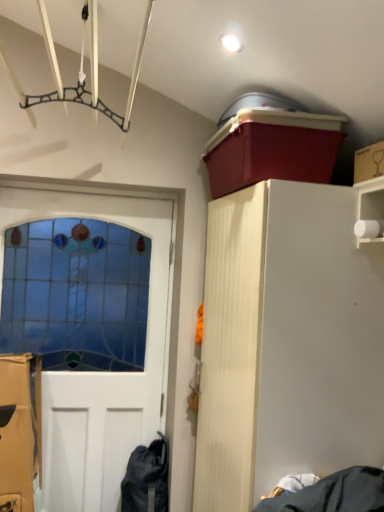
Question: Should I look upward or downward to see cardboard box at upper right?

Choices:
 (A) down
 (B) up

Answer: (B)

Question: Does stained glass door at left turn towards matte plastic storage bin at upper right?

Choices:
 (A) no
 (B) yes

Answer: (A)

Question: Does stained glass door at left have a greater width compared to matte plastic storage bin at upper right?

Choices:
 (A) no
 (B) yes

Answer: (A)

Question: Is stained glass door at left looking in the opposite direction of matte plastic storage bin at upper right?

Choices:
 (A) no
 (B) yes

Answer: (A)

Question: From a real-world perspective, is stained glass door at left positioned over matte plastic storage bin at upper right based on gravity?

Choices:
 (A) no
 (B) yes

Answer: (A)

Question: Is stained glass door at left positioned beyond the bounds of matte plastic storage bin at upper right?

Choices:
 (A) yes
 (B) no

Answer: (A)

Question: Are stained glass door at left and matte plastic storage bin at upper right far apart?

Choices:
 (A) yes
 (B) no

Answer: (B)

Question: Considering the relative positions of cardboard box at upper right and white wood cabinet at upper right in the image provided, is cardboard box at upper right to the left of white wood cabinet at upper right from the viewer's perspective?

Choices:
 (A) yes
 (B) no

Answer: (B)

Question: Is cardboard box at upper right placed right next to white wood cabinet at upper right?

Choices:
 (A) yes
 (B) no

Answer: (B)

Question: From the image's perspective, is cardboard box at upper right located beneath white wood cabinet at upper right?

Choices:
 (A) no
 (B) yes

Answer: (A)

Question: Is cardboard box at upper right positioned beyond the bounds of white wood cabinet at upper right?

Choices:
 (A) no
 (B) yes

Answer: (B)

Question: Does cardboard box at upper right have a larger size compared to white wood cabinet at upper right?

Choices:
 (A) no
 (B) yes

Answer: (A)

Question: Is the position of cardboard box at upper right less distant than that of white wood cabinet at upper right?

Choices:
 (A) yes
 (B) no

Answer: (A)

Question: From a real-world perspective, is matte plastic storage bin at upper right over stained glass door at left?

Choices:
 (A) yes
 (B) no

Answer: (A)